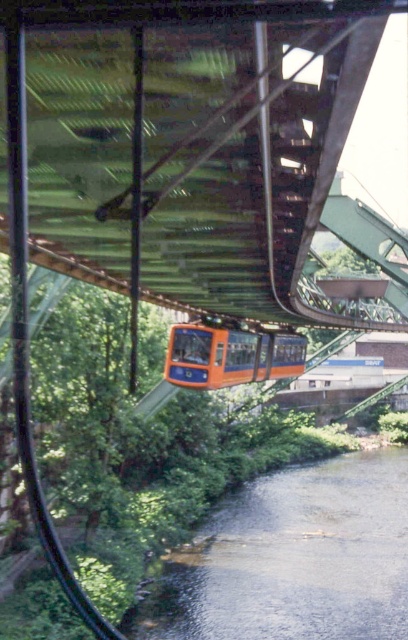
You are a passenger in the orange matte train at center. You want to know if the clear water at lower center is wider than the train. Can you determine this?

The clear water at lower center might be wider than orange matte train at center according to the description.

You are a passenger on the orange matte train at center and want to see the clear water at lower center. Which direction should you look to see it?

The clear water at lower center is to the right of the orange matte train at center, so you should look to your right to see it.